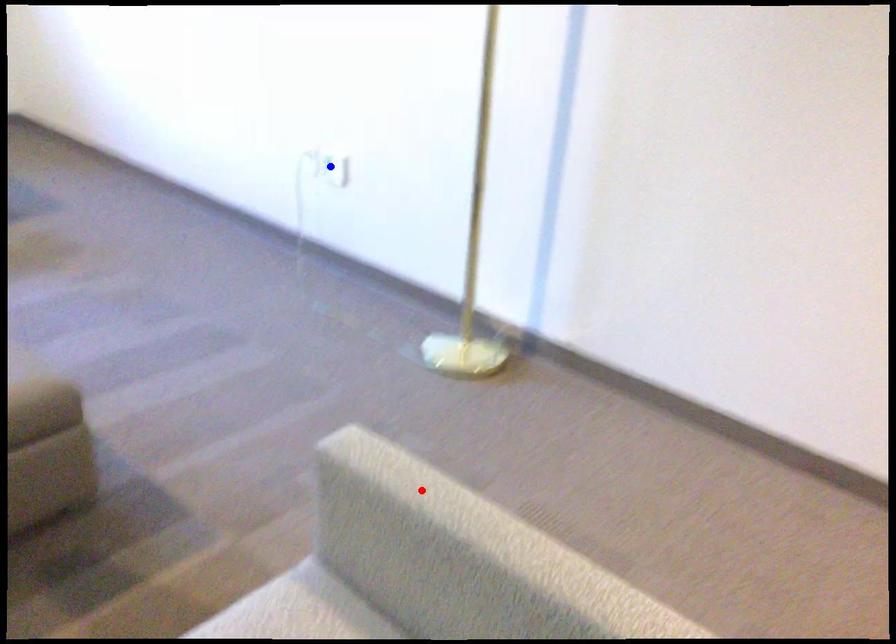
Question: In the image, two points are highlighted. Which point is nearer to the camera? Reply with the corresponding letter.

Choices:
 (A) blue point
 (B) red point

Answer: (B)